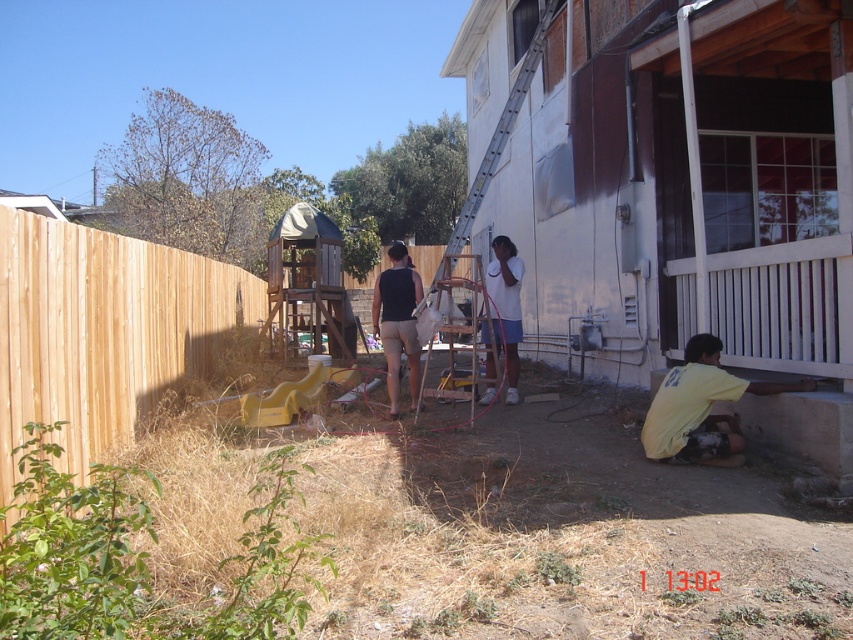
Question: Which point is closer to the camera?

Choices:
 (A) tap(80, 435)
 (B) tap(712, 349)

Answer: (A)

Question: Estimate the real-world distances between objects in this image. Which object is farther from the white matte shirt at center?

Choices:
 (A) matte black tank top at center
 (B) yellow matte shirt at lower right

Answer: (B)

Question: From the image, what is the correct spatial relationship of yellow matte shirt at lower right in relation to metallic silver ladder at center?

Choices:
 (A) right
 (B) left

Answer: (A)

Question: Is brown wood fence at left smaller than matte black tank top at center?

Choices:
 (A) no
 (B) yes

Answer: (B)

Question: Is matte black tank top at center positioned behind metallic silver ladder at center?

Choices:
 (A) yes
 (B) no

Answer: (B)

Question: Which point is farther to the camera?

Choices:
 (A) brown wood fence at left
 (B) yellow matte shirt at lower right

Answer: (B)